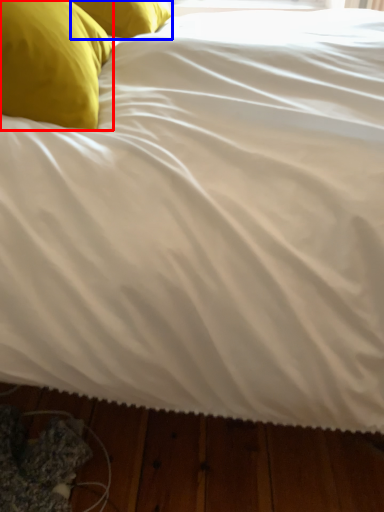
Question: Which of the following is the farthest to the observer, pillow (highlighted by a red box) or pillow (highlighted by a blue box)?

Choices:
 (A) pillow
 (B) pillow

Answer: (B)